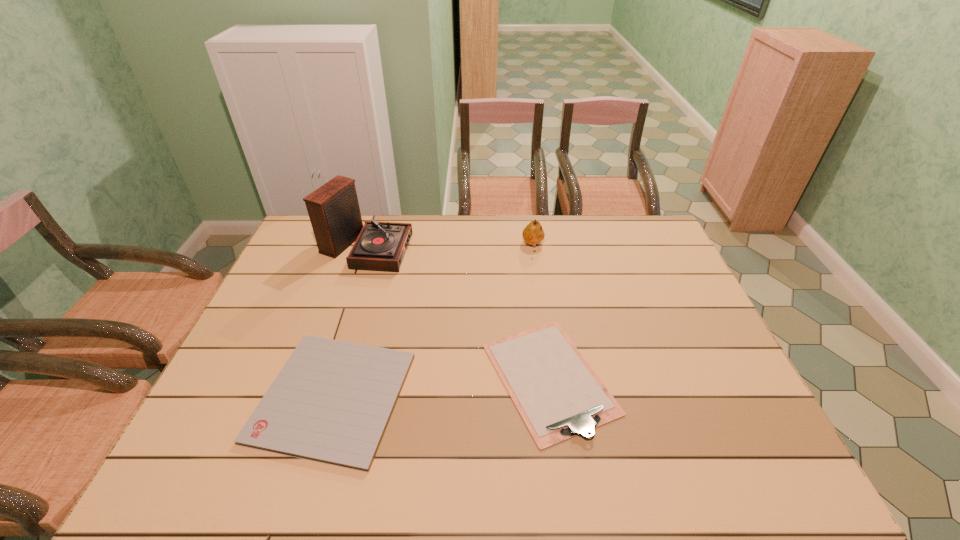
You are a GUI agent. You are given a task and a screenshot of the screen. Output one action in this format:
    pyautogui.click(x=<x>, y=<y>)
    Task: Click on the free space at the far right corner of the desktop
    The width and height of the screenshot is (960, 540).
    Given the screenshot: What is the action you would take?
    pyautogui.click(x=628, y=221)

Identify the location of unoccupied area between the left clipboard and the third tallest object. The width and height of the screenshot is (960, 540). (442, 387).

Locate an element on the screen. The image size is (960, 540). vacant region between the third shortest object and the tallest object is located at coordinates (450, 245).

This screenshot has height=540, width=960. In order to click on vacant region between the shortest object and the tallest object in this screenshot , I will do `click(350, 321)`.

The image size is (960, 540). I want to click on vacant space that is in between the right clipboard and the pear, so click(541, 312).

Locate an element on the screen. Image resolution: width=960 pixels, height=540 pixels. unoccupied area between the phonograph record and the third tallest object is located at coordinates (458, 312).

At what (x,y) coordinates should I click in order to perform the action: click on empty location between the phonograph record and the second shortest object. Please return your answer as a coordinate pair (x, y). Looking at the image, I should click on (458, 312).

Where is `free space between the phonograph record and the left clipboard`? The height and width of the screenshot is (540, 960). free space between the phonograph record and the left clipboard is located at coordinates click(350, 321).

In order to click on vacant space that's between the taller clipboard and the tallest object in this screenshot , I will do `click(458, 312)`.

You are a GUI agent. You are given a task and a screenshot of the screen. Output one action in this format:
    pyautogui.click(x=<x>, y=<y>)
    Task: Click on the empty space that is in between the right clipboard and the third shortest object
    Image resolution: width=960 pixels, height=540 pixels.
    Given the screenshot: What is the action you would take?
    pyautogui.click(x=541, y=312)